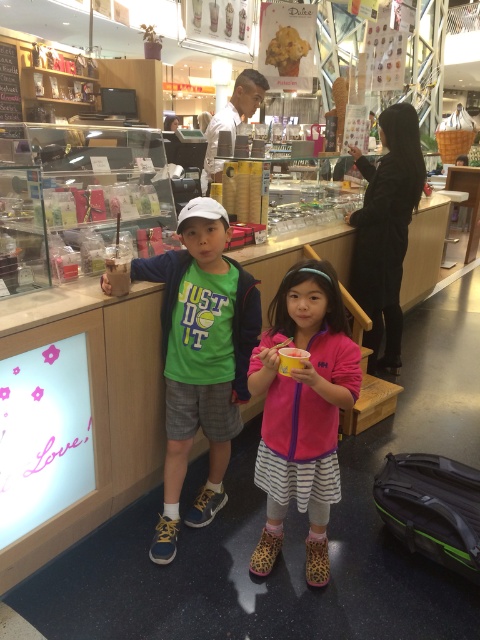
You are a customer in the cafe and want to buy a drink for both the green fabric shirt at center and the pink fleece jacket at center. The cups available are 12 oz and 16 oz. Which cup size should you choose for each based on their clothing sizes?

The green fabric shirt at center is taller than the pink fleece jacket at center, so you should choose a 16 oz cup for the green fabric shirt at center and a 12 oz cup for the pink fleece jacket at center.

You are a photographer trying to capture a photo of the two children in the scene. Since the green fabric shirt at center and the pink fleece jacket at center are both in the frame, which one is positioned higher in the image?

The green fabric shirt at center is located above the pink fleece jacket at center, so it is positioned higher in the image.

You are a photographer standing in the center of the room. You want to take a photo of the pink fleece jacket at center. Which direction should you move to get a better shot?

The pink fleece jacket at center is located at point (302, 410), so you should move to the right to center it in your frame.